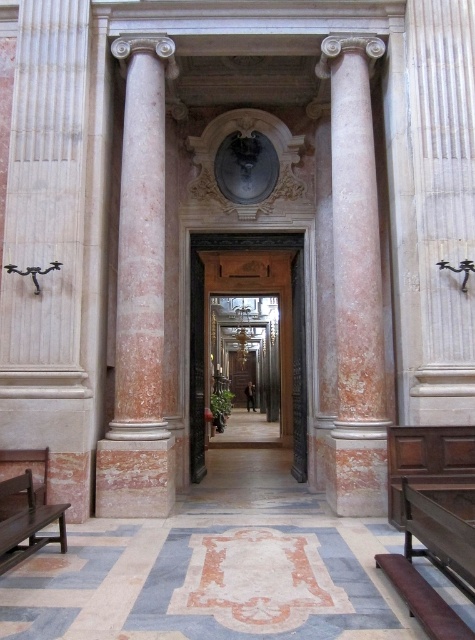
Who is lower down, brown leather bench at lower right or wooden bench at lower left?

Positioned lower is wooden bench at lower left.

Can you confirm if brown leather bench at lower right is shorter than wooden bench at lower left?

Incorrect, brown leather bench at lower right's height does not fall short of wooden bench at lower left's.

Which is behind, point (425, 588) or point (66, 502)?

The point (66, 502) is more distant.

You are a GUI agent. You are given a task and a screenshot of the screen. Output one action in this format:
    pyautogui.click(x=<x>, y=<y>)
    Task: Click on the brown leather bench at lower right
    This screenshot has width=475, height=640.
    Given the screenshot: What is the action you would take?
    pyautogui.click(x=433, y=563)

Which is above, brown leather bench at lower right or wooden door at center?

Positioned higher is wooden door at center.

The height and width of the screenshot is (640, 475). What do you see at coordinates (433, 563) in the screenshot?
I see `brown leather bench at lower right` at bounding box center [433, 563].

Is point (471, 502) farther from viewer compared to point (190, 467)?

No.

The width and height of the screenshot is (475, 640). Identify the location of brown leather bench at lower right. point(433,563).

Between pink marble column at center and brown leather bench at lower right, which one is positioned higher?

Positioned higher is brown leather bench at lower right.

Between point (372, 381) and point (456, 534), which one is positioned in front?

Point (456, 534) is in front.

Who is more distant from viewer, (343,305) or (457,618)?

Point (343,305)

Locate an element on the screen. The image size is (475, 640). pink marble column at center is located at coordinates (355, 284).